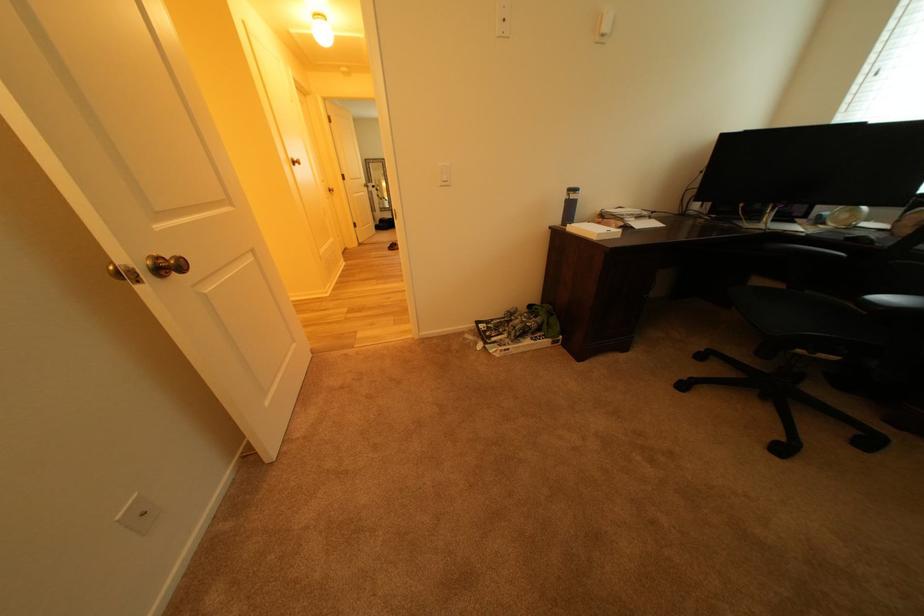
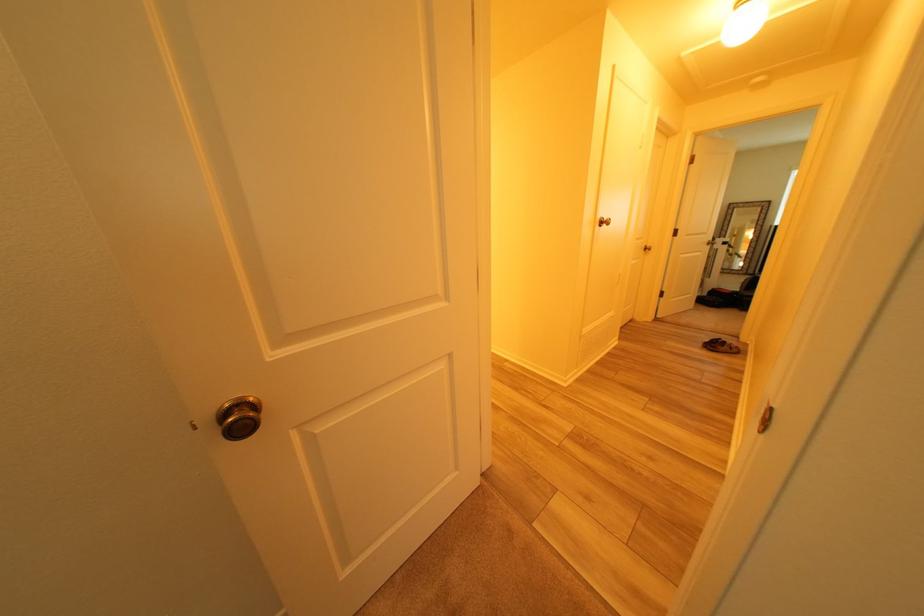
Question: Based on the continuous images, in which direction is the camera rotating? Reply with the corresponding letter.

Choices:
 (A) Left
 (B) Right
 (C) Up
 (D) Down

Answer: (A)